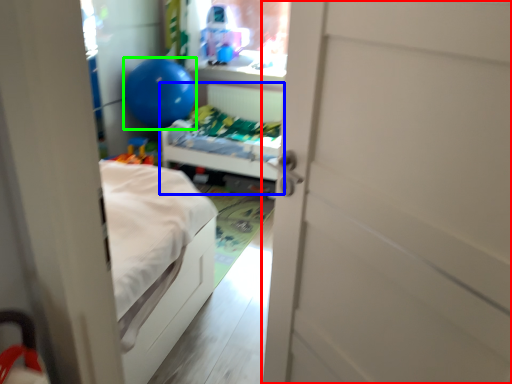
Question: Which object is the farthest from door (highlighted by a red box)? Choose among these: hospital bed (highlighted by a blue box) or balloon (highlighted by a green box).

Choices:
 (A) hospital bed
 (B) balloon

Answer: (B)